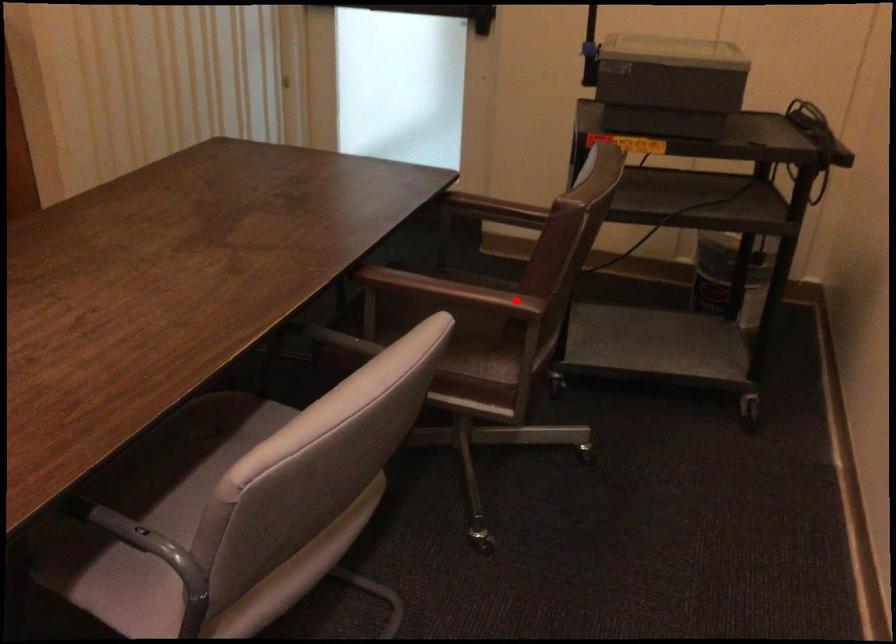
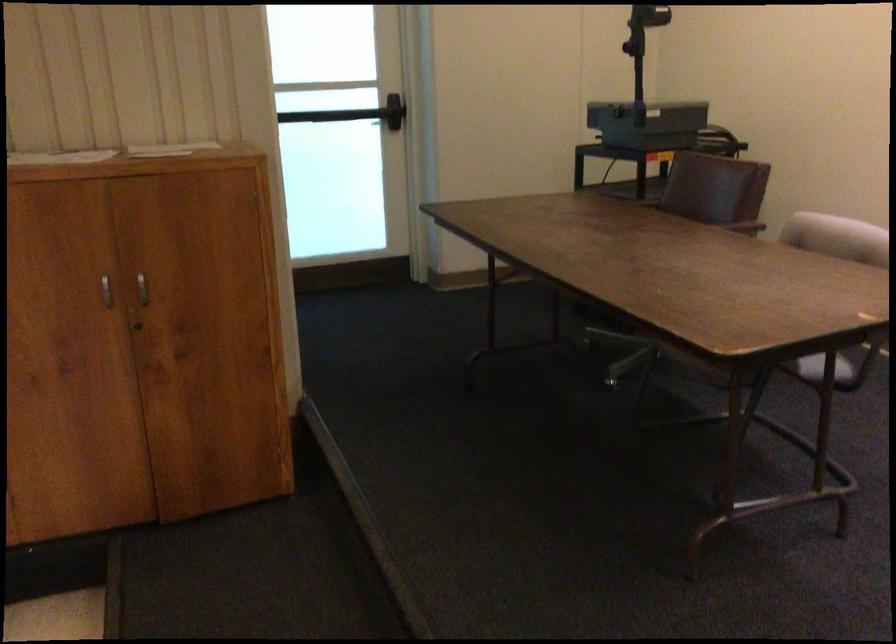
In the second image, find the point that corresponds to the highlighted location in the first image.

(739, 223)